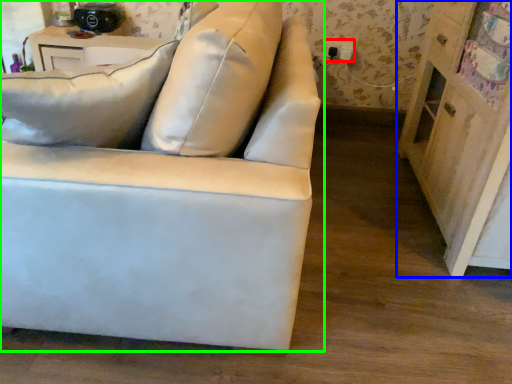
Question: Estimate the real-world distances between objects in this image. Which object is closer to electric outlet (highlighted by a red box), dresser (highlighted by a blue box) or studio couch (highlighted by a green box)?

Choices:
 (A) dresser
 (B) studio couch

Answer: (A)